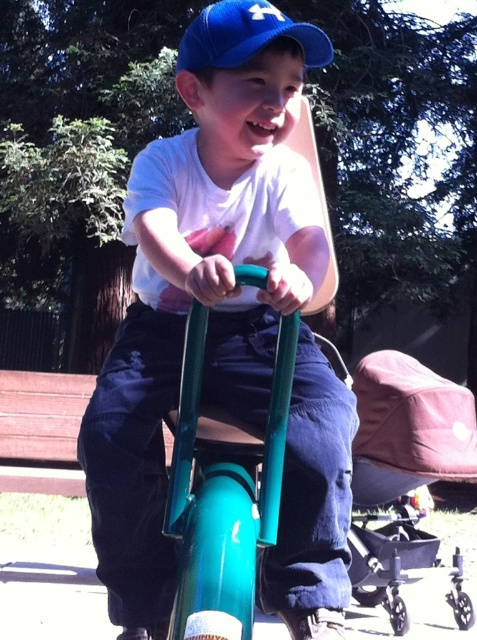
Question: Which object is farther from the camera taking this photo?

Choices:
 (A) blue fabric cap at upper center
 (B) matte blue cap at upper center
 (C) black plastic stroller at lower right

Answer: (C)

Question: Which object is closer to the camera taking this photo?

Choices:
 (A) blue fabric cap at upper center
 (B) matte blue cap at upper center

Answer: (B)

Question: Observing the image, what is the correct spatial positioning of black plastic stroller at lower right in reference to blue fabric cap at upper center?

Choices:
 (A) above
 (B) below

Answer: (B)

Question: Does matte blue cap at upper center have a lesser width compared to black plastic stroller at lower right?

Choices:
 (A) no
 (B) yes

Answer: (B)

Question: Which of the following is the farthest from the observer?

Choices:
 (A) blue fabric cap at upper center
 (B) black plastic stroller at lower right
 (C) matte blue cap at upper center

Answer: (B)

Question: In this image, where is matte blue cap at upper center located relative to blue fabric cap at upper center?

Choices:
 (A) below
 (B) above

Answer: (A)